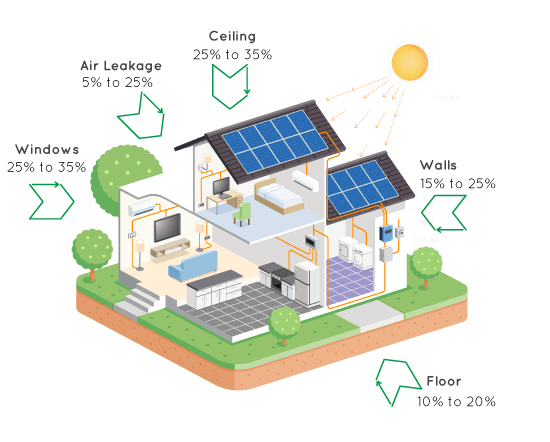
At what (x,y) coordinates should I click in order to perform the action: click on flooring. Please return your answer as a coordinate pair (x, y). The width and height of the screenshot is (550, 442). Looking at the image, I should click on (355, 280), (252, 316), (155, 272), (262, 218).